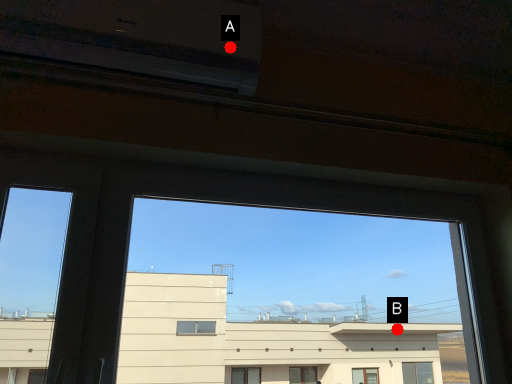
Question: Two points are circled on the image, labeled by A and B beside each circle. Which point is farther to the camera?

Choices:
 (A) A is further
 (B) B is further

Answer: (B)